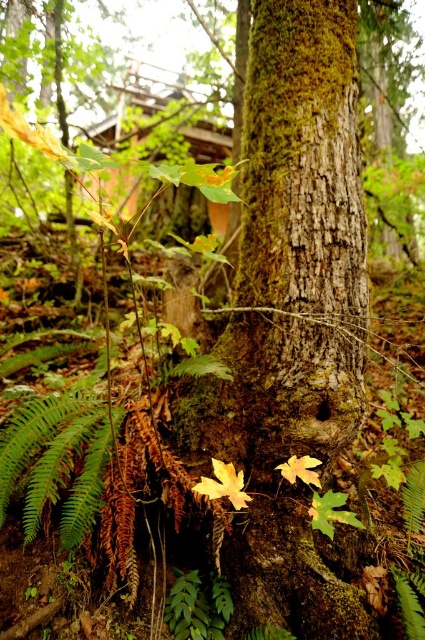
Is yellow matte maple leaf at center smaller than yellow matte maple leaf at lower center?

No, yellow matte maple leaf at center is not smaller than yellow matte maple leaf at lower center.

Between yellow matte maple leaf at center and yellow matte maple leaf at lower center, which one is positioned higher?

Positioned higher is yellow matte maple leaf at lower center.

The width and height of the screenshot is (425, 640). I want to click on yellow matte maple leaf at center, so click(223, 484).

Is green glossy fern at lower left positioned behind yellow matte maple leaf at lower center?

No.

Describe the element at coordinates (56, 460) in the screenshot. I see `green glossy fern at lower left` at that location.

Find the location of a particular element. Image resolution: width=425 pixels, height=640 pixels. green glossy fern at lower left is located at coordinates (56, 460).

Between green glossy fern at lower left and yellow matte maple leaf at center, which one appears on the right side from the viewer's perspective?

yellow matte maple leaf at center is more to the right.

Is point (30, 401) positioned before point (227, 486)?

No, (30, 401) is behind (227, 486).

Image resolution: width=425 pixels, height=640 pixels. Find the location of `green glossy fern at lower left`. green glossy fern at lower left is located at coordinates (56, 460).